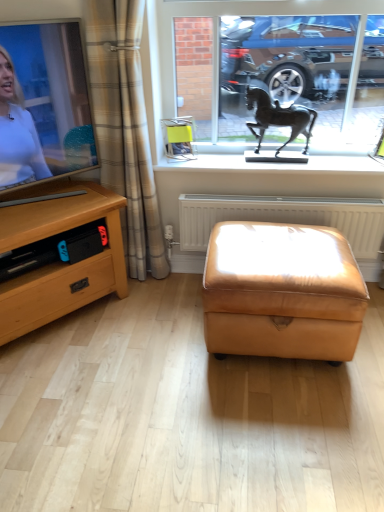
Question: Should I look upward or downward to see metallic horse statue at upper center?

Choices:
 (A) up
 (B) down

Answer: (A)

Question: From a real-world perspective, is wooden desk at left over saddle brown leather ottoman at center?

Choices:
 (A) no
 (B) yes

Answer: (B)

Question: Is wooden desk at left at the left side of saddle brown leather ottoman at center?

Choices:
 (A) no
 (B) yes

Answer: (B)

Question: Is wooden desk at left aimed at saddle brown leather ottoman at center?

Choices:
 (A) no
 (B) yes

Answer: (A)

Question: Is there a large distance between wooden desk at left and saddle brown leather ottoman at center?

Choices:
 (A) yes
 (B) no

Answer: (B)

Question: From the image's perspective, is wooden desk at left beneath saddle brown leather ottoman at center?

Choices:
 (A) no
 (B) yes

Answer: (A)

Question: Does wooden desk at left contain saddle brown leather ottoman at center?

Choices:
 (A) no
 (B) yes

Answer: (A)

Question: Is saddle brown leather ottoman at center smaller than bronze horse at center?

Choices:
 (A) no
 (B) yes

Answer: (A)

Question: Is saddle brown leather ottoman at center beside bronze horse at center?

Choices:
 (A) yes
 (B) no

Answer: (B)

Question: Can you confirm if saddle brown leather ottoman at center is positioned to the left of bronze horse at center?

Choices:
 (A) yes
 (B) no

Answer: (A)

Question: Can you confirm if saddle brown leather ottoman at center is shorter than bronze horse at center?

Choices:
 (A) no
 (B) yes

Answer: (A)

Question: From the image's perspective, is saddle brown leather ottoman at center above bronze horse at center?

Choices:
 (A) no
 (B) yes

Answer: (A)

Question: Does saddle brown leather ottoman at center have a greater height compared to bronze horse at center?

Choices:
 (A) yes
 (B) no

Answer: (A)

Question: Is metallic horse statue at upper center in front of white plastic radiator at center?

Choices:
 (A) no
 (B) yes

Answer: (B)